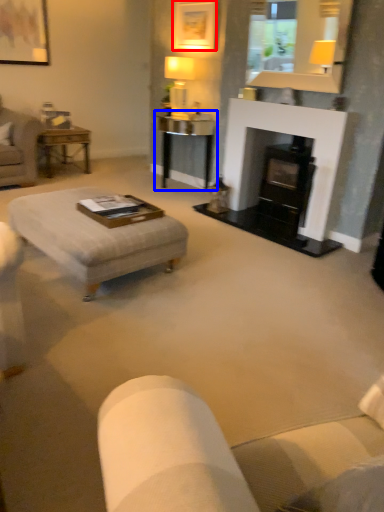
Question: Which object is closer to the camera taking this photo, picture frame (highlighted by a red box) or table (highlighted by a blue box)?

Choices:
 (A) picture frame
 (B) table

Answer: (A)